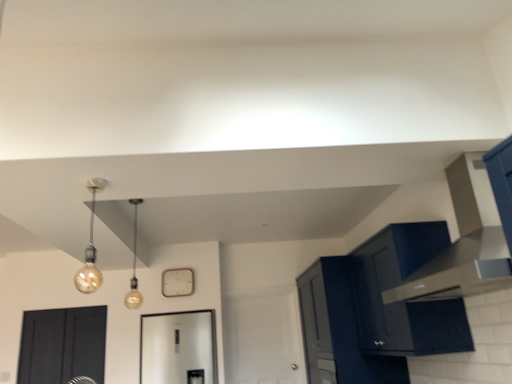
The image size is (512, 384). Describe the element at coordinates (178, 347) in the screenshot. I see `white glossy mirror at center` at that location.

The height and width of the screenshot is (384, 512). I want to click on matte black vent at upper right, so click(464, 243).

The height and width of the screenshot is (384, 512). Describe the element at coordinates (338, 330) in the screenshot. I see `matte dark blue cabinet at upper right, which is the 1th cabinetry from back to front` at that location.

What do you see at coordinates (177, 282) in the screenshot?
I see `white matte clock at center` at bounding box center [177, 282].

Image resolution: width=512 pixels, height=384 pixels. I want to click on matte black door at lower left, which appears as the 2th door when viewed from the back, so click(x=62, y=345).

Would you say white matte clock at center is inside or outside matte black vent at upper right?

white matte clock at center is not enclosed by matte black vent at upper right.

Looking at this image, can you tell me how much white matte clock at center and matte black vent at upper right differ in facing direction?

The facing directions of white matte clock at center and matte black vent at upper right are 88.9 degrees apart.

Considering the relative sizes of white matte clock at center and matte black vent at upper right in the image provided, is white matte clock at center shorter than matte black vent at upper right?

Indeed, white matte clock at center has a lesser height compared to matte black vent at upper right.

Is the depth of white matte clock at center greater than that of matte black vent at upper right?

Yes, it is behind matte black vent at upper right.

Considering the positions of objects white matte door at center, positioned as the 2th door in left-to-right order, and matte dark blue cabinet at upper right, which is the 1th cabinetry from back to front, in the image provided, who is more to the right, white matte door at center, positioned as the 2th door in left-to-right order, or matte dark blue cabinet at upper right, which is the 1th cabinetry from back to front,?

matte dark blue cabinet at upper right, which is the 1th cabinetry from back to front, is more to the right.

Is white matte door at center, the 1th door when ordered from right to left, facing away from matte dark blue cabinet at upper right, the second cabinetry viewed from the front?

white matte door at center, the 1th door when ordered from right to left, does not have its back to matte dark blue cabinet at upper right, the second cabinetry viewed from the front.

Is matte dark blue cabinet at upper right, the second cabinetry viewed from the front, located within white matte door at center, which ranks as the 2th door in front-to-back order?

No.

Is white matte door at center, positioned as the 2th door in left-to-right order, wider than matte dark blue cabinet at upper right, the second cabinetry viewed from the front?

No.

Is white matte clock at center surrounding matte dark blue cabinet at upper right, the second cabinetry viewed from the front?

No, matte dark blue cabinet at upper right, the second cabinetry viewed from the front, is located outside of white matte clock at center.

Locate an element on the screen. The height and width of the screenshot is (384, 512). clock that is above the matte dark blue cabinet at upper right, which is the 1th cabinetry from back to front (from the image's perspective) is located at coordinates (177, 282).

Between white matte clock at center and matte dark blue cabinet at upper right, which is the 1th cabinetry from back to front, which one has smaller size?

Smaller between the two is white matte clock at center.

In the scene shown: Is matte black vent at upper right inside the boundaries of white matte clock at center, or outside?

The correct answer is: outside.

From a real-world perspective, is matte black vent at upper right positioned above or below white matte clock at center?

matte black vent at upper right is situated lower than white matte clock at center in the real world.

Is matte black vent at upper right far away from white matte clock at center?

Yes, matte black vent at upper right and white matte clock at center are quite far apart.

Considering the positions of objects white glossy mirror at center and matte gold bulb at upper left, placed as the first light fixture when sorted from front to back, in the image provided, who is more to the right, white glossy mirror at center or matte gold bulb at upper left, placed as the first light fixture when sorted from front to back,?

white glossy mirror at center.

Between white glossy mirror at center and matte gold bulb at upper left, placed as the first light fixture when sorted from front to back, which one has less height?

matte gold bulb at upper left, placed as the first light fixture when sorted from front to back, is shorter.

From the image's perspective, which one is positioned higher, white glossy mirror at center or matte gold bulb at upper left, placed as the first light fixture when sorted from front to back?

matte gold bulb at upper left, placed as the first light fixture when sorted from front to back, from the image's perspective.

Does matte black vent at upper right contain matte black cabinet at right, the first cabinetry when ordered from front to back?

No, matte black cabinet at right, the first cabinetry when ordered from front to back, is not surrounded by matte black vent at upper right.

From the picture: Which is farther, [462,215] or [411,242]?

The point [462,215] is farther from the camera.

In order to click on cabinetry on the right of the matte black vent at upper right in this screenshot , I will do `click(405, 301)`.

From a real-world perspective, is white matte door at center, the 1th door when ordered from right to left, located higher than white glossy mirror at center?

Yes, from a real-world perspective, white matte door at center, the 1th door when ordered from right to left, is on top of white glossy mirror at center.

Is white matte door at center, which ranks as the 2th door in front-to-back order, wider than white glossy mirror at center?

No, white matte door at center, which ranks as the 2th door in front-to-back order, is not wider than white glossy mirror at center.

From the picture: Considering the relative sizes of white matte door at center, the 1th door when ordered from right to left, and white glossy mirror at center in the image provided, is white matte door at center, the 1th door when ordered from right to left, shorter than white glossy mirror at center?

In fact, white matte door at center, the 1th door when ordered from right to left, may be taller than white glossy mirror at center.

Is white matte door at center, the 1th door when ordered from right to left, not near white glossy mirror at center?

No.

The image size is (512, 384). I want to click on clock above the matte black vent at upper right (from a real-world perspective), so click(x=177, y=282).

The width and height of the screenshot is (512, 384). Find the location of `the 2nd door below the matte dark blue cabinet at upper right, which is the 1th cabinetry from back to front (from the image's perspective)`. the 2nd door below the matte dark blue cabinet at upper right, which is the 1th cabinetry from back to front (from the image's perspective) is located at coordinates click(x=263, y=340).

When comparing their distances from white matte clock at center, does matte black vent at upper right or white matte door at center, which ranks as the 2th door in front-to-back order, seem further?

matte black vent at upper right is further to white matte clock at center.

From the image, which object appears to be nearer to white matte clock at center, matte black door at lower left, which is the second door in right-to-left order, or matte gold bulb at upper left, placed as the first light fixture when sorted from front to back?

matte gold bulb at upper left, placed as the first light fixture when sorted from front to back, is closer to white matte clock at center.

Estimate the real-world distances between objects in this image. Which object is closer to white matte clock at center, matte black vent at upper right or matte glass bulb at center, marked as the 2th light fixture in a front-to-back arrangement?

matte glass bulb at center, marked as the 2th light fixture in a front-to-back arrangement.

When comparing their distances from matte glass bulb at center, marked as the 2th light fixture in a front-to-back arrangement, does white matte clock at center or white glossy mirror at center seem closer?

white matte clock at center is positioned closer to the anchor matte glass bulb at center, marked as the 2th light fixture in a front-to-back arrangement.

Based on their spatial positions, is matte dark blue cabinet at upper right, the second cabinetry viewed from the front, or matte black cabinet at right, the first cabinetry when ordered from front to back, closer to matte glass bulb at center, marked as the 2th light fixture in a front-to-back arrangement?

matte dark blue cabinet at upper right, the second cabinetry viewed from the front, is positioned closer to the anchor matte glass bulb at center, marked as the 2th light fixture in a front-to-back arrangement.

Based on their spatial positions, is matte black cabinet at right, the first cabinetry when ordered from front to back, or white matte door at center, the 1th door when ordered from right to left, closer to white matte clock at center?

white matte door at center, the 1th door when ordered from right to left, is closer to white matte clock at center.

Looking at the image, which one is located closer to matte black vent at upper right, white matte door at center, the 1th door when ordered from back to front, or matte gold bulb at upper left, placed as the first light fixture when sorted from front to back?

Based on the image, white matte door at center, the 1th door when ordered from back to front, appears to be nearer to matte black vent at upper right.

Looking at the image, which one is located further to matte glass bulb at center, which is counted as the first light fixture, starting from the back, matte black door at lower left, which appears as the 2th door when viewed from the back, or matte gold bulb at upper left, placed as the first light fixture when sorted from front to back?

Among the two, matte black door at lower left, which appears as the 2th door when viewed from the back, is located further to matte glass bulb at center, which is counted as the first light fixture, starting from the back.

Locate an element on the screen. The height and width of the screenshot is (384, 512). clock between matte glass bulb at center, marked as the 2th light fixture in a front-to-back arrangement, and matte black cabinet at right, the first cabinetry when ordered from front to back is located at coordinates 177,282.

Locate an element on the screen. mirror between matte black door at lower left, which is the first door in front-to-back order, and matte dark blue cabinet at upper right, the second cabinetry viewed from the front, from left to right is located at coordinates (178, 347).

The width and height of the screenshot is (512, 384). I want to click on light fixture between matte glass bulb at center, which is counted as the first light fixture, starting from the back, and matte black cabinet at right, which is the 2th cabinetry from back to front, from left to right, so click(x=90, y=248).

Where is `mirror between matte black cabinet at right, the first cabinetry when ordered from front to back, and white matte clock at center, along the z-axis`? Image resolution: width=512 pixels, height=384 pixels. mirror between matte black cabinet at right, the first cabinetry when ordered from front to back, and white matte clock at center, along the z-axis is located at coordinates (178, 347).